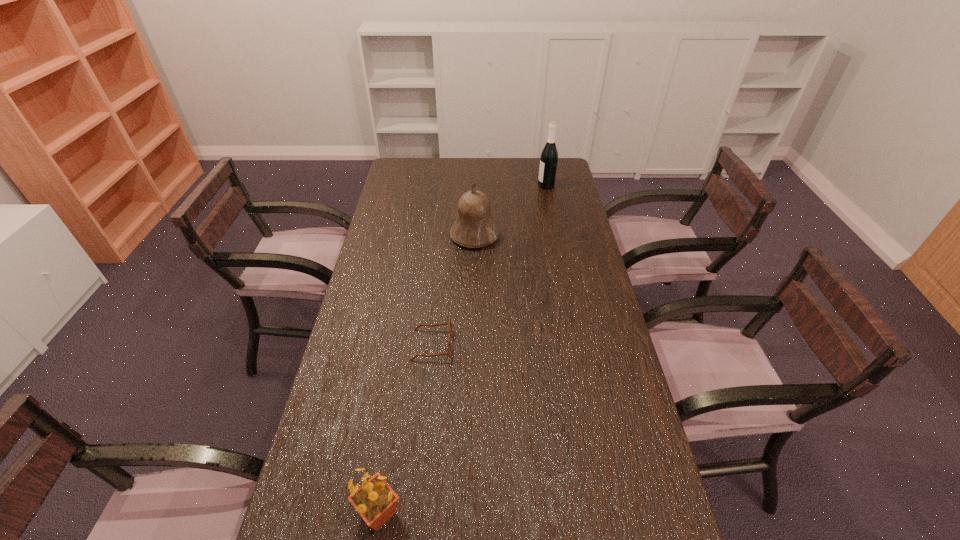
I want to click on the tallest object, so click(x=549, y=156).

Locate an element on the screen. This screenshot has width=960, height=540. the farthest object is located at coordinates (549, 156).

The height and width of the screenshot is (540, 960). What are the coordinates of `bell` in the screenshot? It's located at (474, 227).

Locate an element on the screen. The height and width of the screenshot is (540, 960). spectacles is located at coordinates (449, 351).

Where is `the second nearest object`? The height and width of the screenshot is (540, 960). the second nearest object is located at coordinates (449, 351).

Find the location of a particular element. free space located on the label of the rightmost object is located at coordinates (525, 185).

This screenshot has height=540, width=960. In order to click on vacant space located on the label of the rightmost object in this screenshot , I will do `click(501, 185)`.

Where is `vacant space located 0.310m on the label of the rightmost object`? The height and width of the screenshot is (540, 960). vacant space located 0.310m on the label of the rightmost object is located at coordinates (470, 185).

The image size is (960, 540). In order to click on vacant space located 0.110m on the right of the bell in this screenshot , I will do `click(526, 235)`.

This screenshot has height=540, width=960. In order to click on free space located on the front-facing side of the spectacles in this screenshot , I will do `click(475, 345)`.